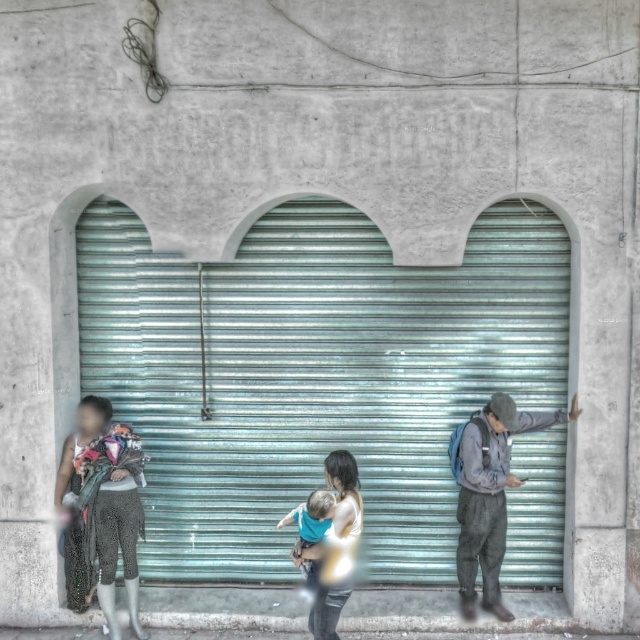
Does sparkly silver pants at left come in front of light blue fabric baby at center?

No, it is behind light blue fabric baby at center.

Between sparkly silver pants at left and light blue fabric baby at center, which one appears on the left side from the viewer's perspective?

Positioned to the left is sparkly silver pants at left.

What do you see at coordinates (100, 509) in the screenshot?
I see `sparkly silver pants at left` at bounding box center [100, 509].

Locate an element on the screen. The image size is (640, 640). sparkly silver pants at left is located at coordinates (100, 509).

In the scene shown: Which is above, gray fabric jacket at right or light blue fabric baby at center?

gray fabric jacket at right is higher up.

Does gray fabric jacket at right have a lesser height compared to light blue fabric baby at center?

In fact, gray fabric jacket at right may be taller than light blue fabric baby at center.

You are a GUI agent. You are given a task and a screenshot of the screen. Output one action in this format:
    pyautogui.click(x=<x>, y=<y>)
    Task: Click on the gray fabric jacket at right
    
    Given the screenshot: What is the action you would take?
    pyautogui.click(x=490, y=496)

Can you confirm if teal corrugated metal at center is bigger than light blue fabric baby at center?

Indeed, teal corrugated metal at center has a larger size compared to light blue fabric baby at center.

Consider the image. Measure the distance between point (275, 236) and camera.

26.78 feet

You are a GUI agent. You are given a task and a screenshot of the screen. Output one action in this format:
    pyautogui.click(x=<x>, y=<y>)
    Task: Click on the teal corrugated metal at center
    
    Given the screenshot: What is the action you would take?
    pyautogui.click(x=314, y=374)

Image resolution: width=640 pixels, height=640 pixels. Find the location of `teal corrugated metal at center`. teal corrugated metal at center is located at coordinates (314, 374).